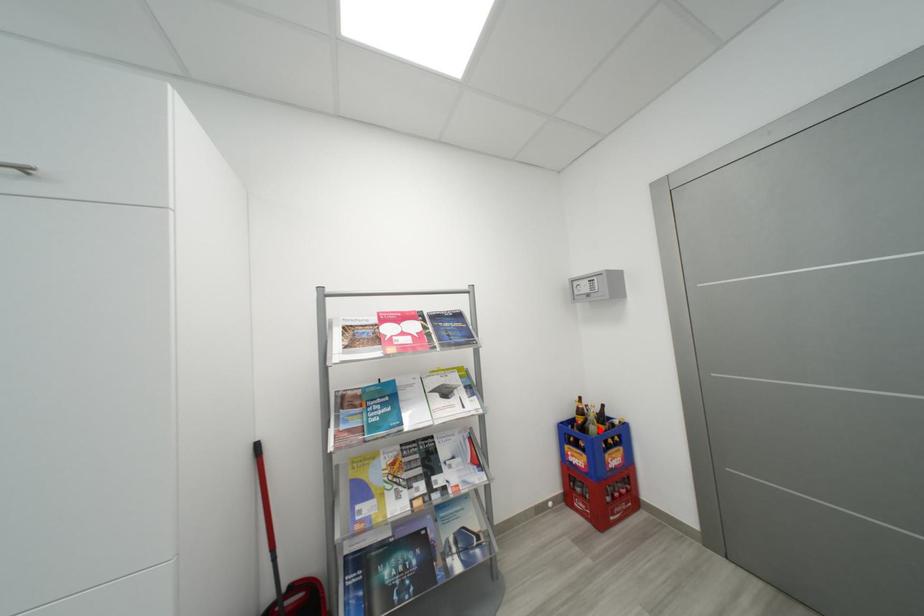
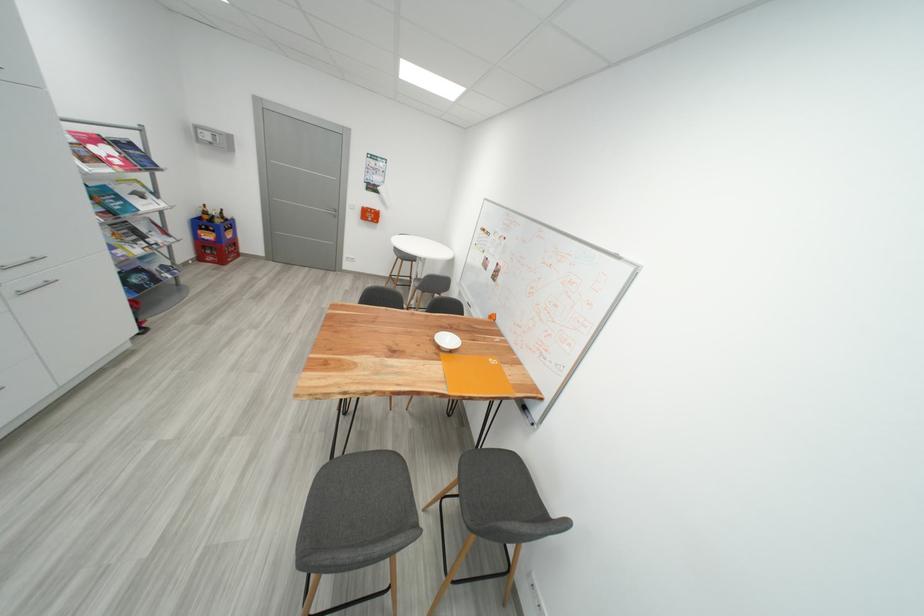
Question: I am providing you with two images of the same scene from different viewpoints. In image1, a red point is highlighted. Considering the same 3D point in image2, which of the following is correct?

Choices:
 (A) It is closer
 (B) It is farther

Answer: (A)